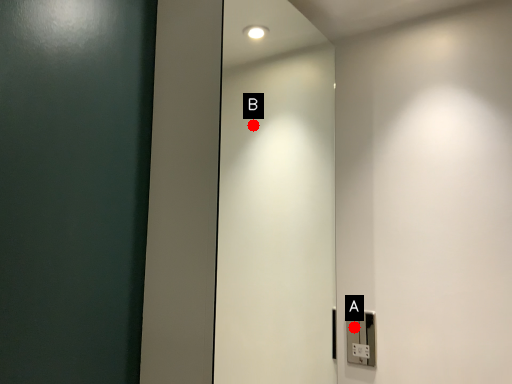
Question: Two points are circled on the image, labeled by A and B beside each circle. Among these points, which one is farthest from the camera?

Choices:
 (A) A is further
 (B) B is further

Answer: (B)